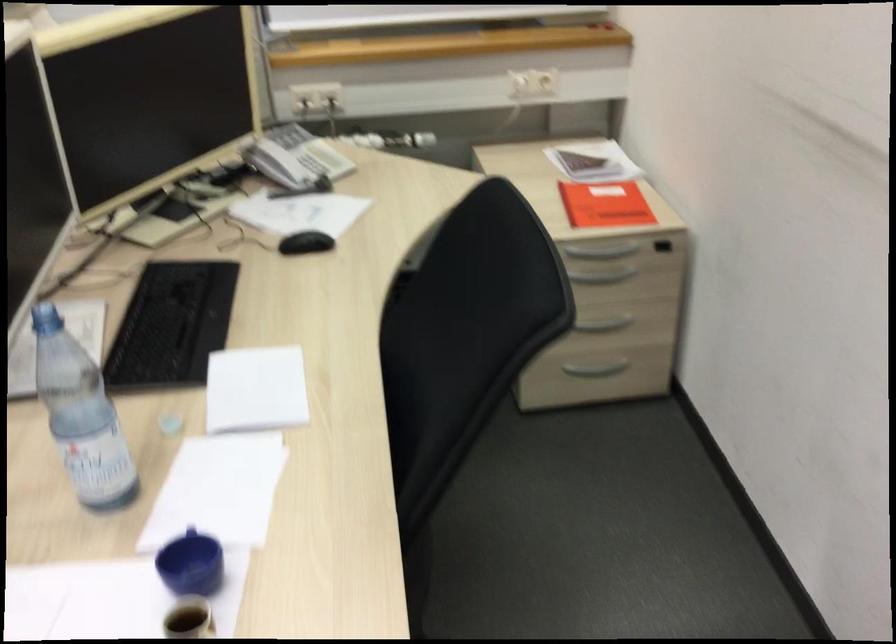
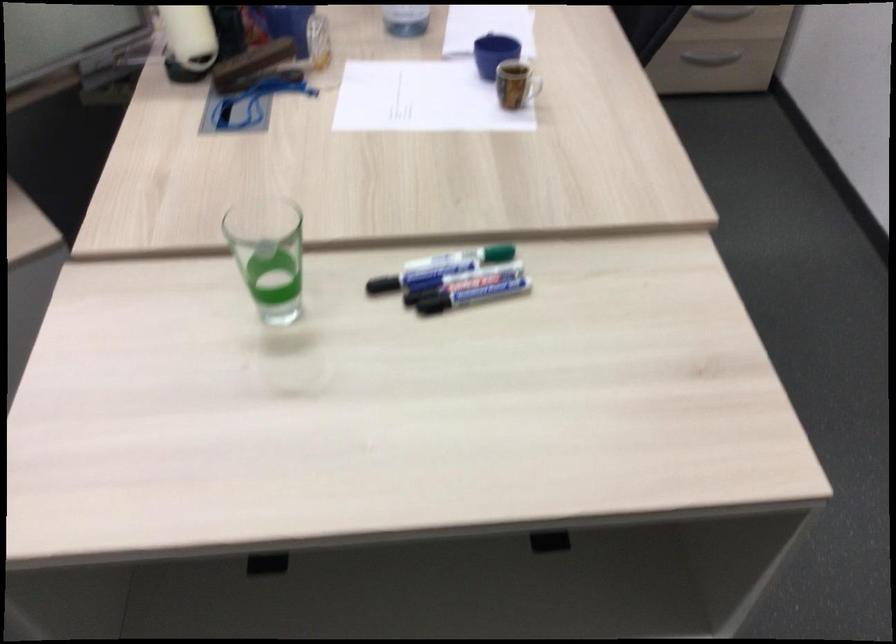
In the second image, find the point that corresponds to [595,372] in the first image.

(708, 61)